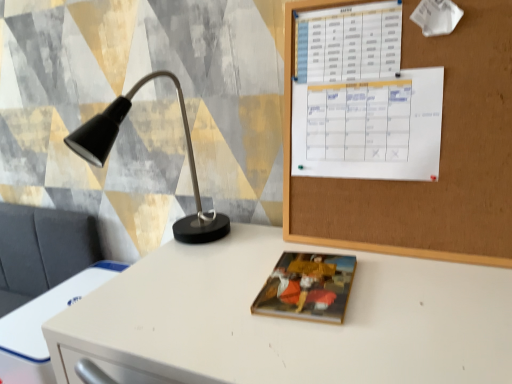
Question: From a real-world perspective, is matte black lamp at left below white plastic drawer at lower left?

Choices:
 (A) yes
 (B) no

Answer: (B)

Question: Does matte black lamp at left turn towards white plastic drawer at lower left?

Choices:
 (A) no
 (B) yes

Answer: (A)

Question: Is matte black lamp at left taller than white plastic drawer at lower left?

Choices:
 (A) no
 (B) yes

Answer: (B)

Question: Is matte black lamp at left outside white plastic drawer at lower left?

Choices:
 (A) yes
 (B) no

Answer: (A)

Question: Considering the relative sizes of matte black lamp at left and white plastic drawer at lower left in the image provided, is matte black lamp at left shorter than white plastic drawer at lower left?

Choices:
 (A) yes
 (B) no

Answer: (B)

Question: Can you confirm if matte black lamp at left is smaller than white plastic drawer at lower left?

Choices:
 (A) no
 (B) yes

Answer: (A)

Question: From the image's perspective, is white plastic drawer at lower left above matte black lamp at left?

Choices:
 (A) yes
 (B) no

Answer: (B)

Question: Does white plastic drawer at lower left come behind matte black lamp at left?

Choices:
 (A) no
 (B) yes

Answer: (B)

Question: Is white plastic drawer at lower left at the left side of matte black lamp at left?

Choices:
 (A) yes
 (B) no

Answer: (A)

Question: Are white plastic drawer at lower left and matte black lamp at left located far from each other?

Choices:
 (A) no
 (B) yes

Answer: (A)

Question: Is white plastic drawer at lower left positioned before matte black lamp at left?

Choices:
 (A) no
 (B) yes

Answer: (A)

Question: Is white plastic drawer at lower left smaller than matte black lamp at left?

Choices:
 (A) yes
 (B) no

Answer: (A)

Question: Can you confirm if white plastic drawer at lower left is shorter than matte paper book at center?

Choices:
 (A) no
 (B) yes

Answer: (A)